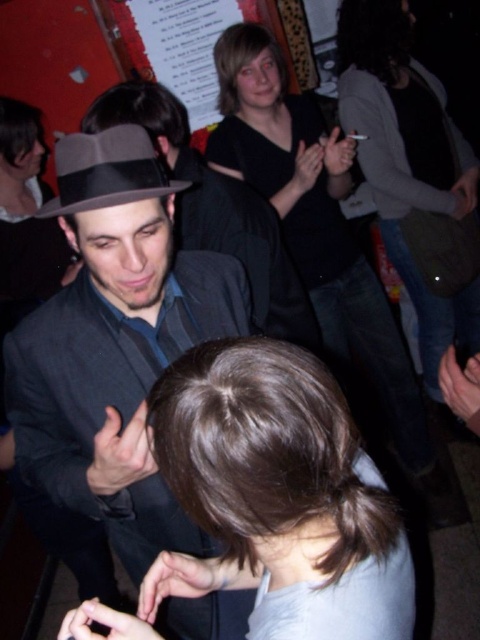
Can you confirm if matte black suit at center is positioned to the right of brown hair at center?

Incorrect, matte black suit at center is not on the right side of brown hair at center.

Which is in front, point (60, 461) or point (189, 486)?

Point (189, 486)

The width and height of the screenshot is (480, 640). I want to click on matte black suit at center, so click(x=116, y=342).

Does matte black suit at center have a greater height compared to gray felt fedora at center?

Indeed, matte black suit at center has a greater height compared to gray felt fedora at center.

Can you confirm if matte black suit at center is shorter than gray felt fedora at center?

No.

Is point (71, 380) positioned after point (88, 150)?

Yes, point (71, 380) is behind point (88, 150).

Locate an element on the screen. This screenshot has width=480, height=640. matte black suit at center is located at coordinates (116, 342).

Can you confirm if black matte shirt at center is thinner than gray felt fedora at center?

In fact, black matte shirt at center might be wider than gray felt fedora at center.

Between black matte shirt at center and gray felt fedora at center, which one appears on the left side from the viewer's perspective?

gray felt fedora at center is more to the left.

Who is more distant from viewer, (252, 166) or (97, 161)?

Positioned behind is point (252, 166).

Find the location of a particular element. This screenshot has height=640, width=480. black matte shirt at center is located at coordinates (314, 224).